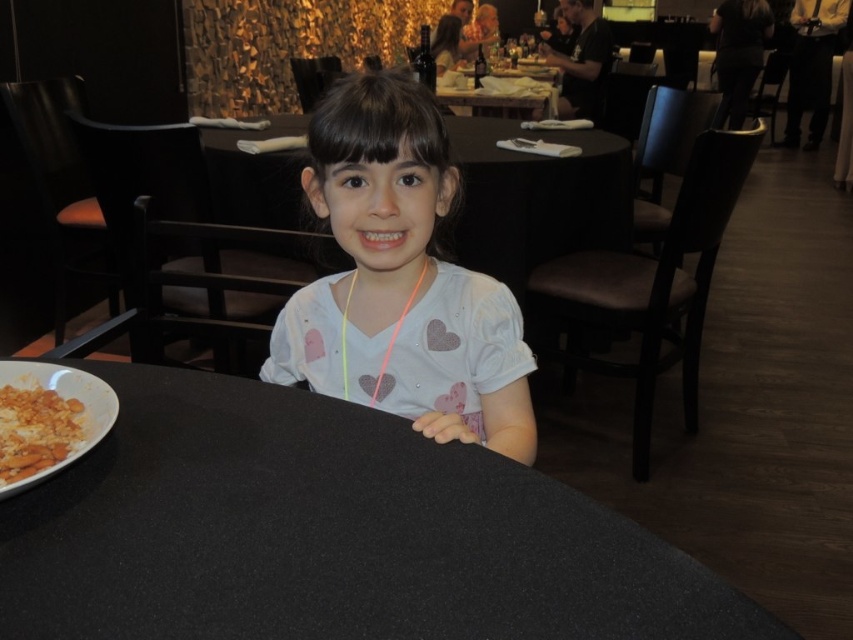
You are a photographer standing at a certain distance from the black matte table at center. You want to capture a closeup shot of the table. The camera requires a minimum distance of 50 centimeters to focus properly. Based on the scene, will the camera be able to focus on the table?

The black matte table at center and camera are 48.33 centimeters apart. Since the required minimum distance is 50 centimeters, the camera will not be able to focus properly on the table.

You are a photographer trying to capture the girl in the center. The camera can only focus on objects within a 0.1 unit radius around the point 0.45, 0.45. Will the white matte shirt at center be in focus?

The white matte shirt at center is located at (399, 280), which is within the 0.1 unit radius of the focus point (383, 288). Therefore, the white matte shirt at center will be in focus.